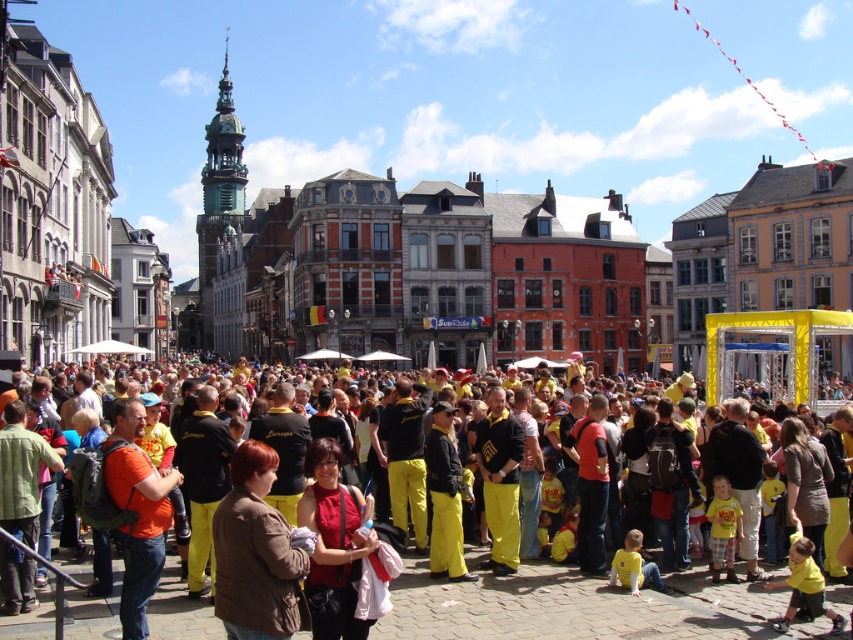
Between yellow fabric crowd at center and brown leather jacket at center, which one appears on the left side from the viewer's perspective?

Positioned to the left is brown leather jacket at center.

Is point (500, 636) more distant than point (289, 573)?

Yes, it is.

I want to click on yellow fabric crowd at center, so click(x=567, y=604).

Where is `yellow fabric crowd at center`? This screenshot has height=640, width=853. yellow fabric crowd at center is located at coordinates (567, 604).

Is yellow fabric crowd at center to the left of matte red blouse at center from the viewer's perspective?

Incorrect, yellow fabric crowd at center is not on the left side of matte red blouse at center.

Identify the location of yellow fabric crowd at center. (567, 604).

Is brown leather jacket at center below matte red blouse at center?

Indeed, brown leather jacket at center is positioned under matte red blouse at center.

Who is positioned more to the right, brown leather jacket at center or matte red blouse at center?

matte red blouse at center

Does point (271, 524) lie in front of point (329, 454)?

Yes, it is.

Locate an element on the screen. brown leather jacket at center is located at coordinates (254, 552).